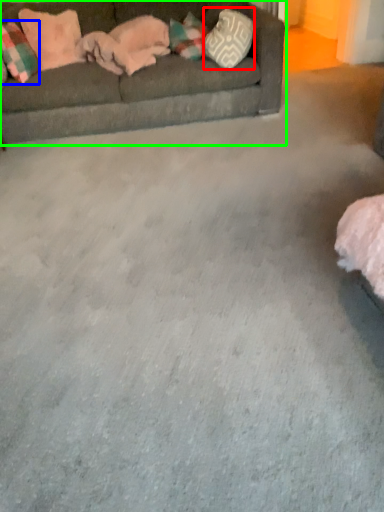
Question: Which is farther away from pillow (highlighted by a red box)? pillow (highlighted by a blue box) or studio couch (highlighted by a green box)?

Choices:
 (A) pillow
 (B) studio couch

Answer: (A)